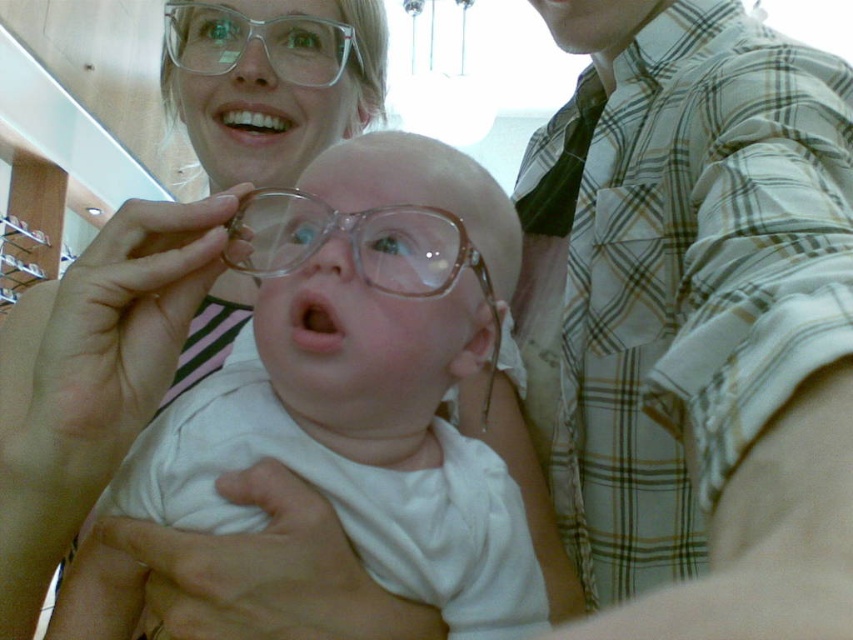
Question: Which point is closer to the camera taking this photo?

Choices:
 (A) (344, 220)
 (B) (712, 612)

Answer: (B)

Question: Can you confirm if plaid shirt at right is positioned to the left of transparent plastic glasses at center?

Choices:
 (A) yes
 (B) no

Answer: (B)

Question: Where is plaid shirt at right located in relation to transparent plastic glasses at center in the image?

Choices:
 (A) above
 (B) below

Answer: (B)

Question: Which point is farther from the camera taking this photo?

Choices:
 (A) (250, 102)
 (B) (370, 209)

Answer: (A)

Question: Among these points, which one is farthest from the camera?

Choices:
 (A) (311, 65)
 (B) (595, 637)

Answer: (A)

Question: Is clear plastic glasses at center thinner than clear plastic glasses at upper center?

Choices:
 (A) no
 (B) yes

Answer: (A)